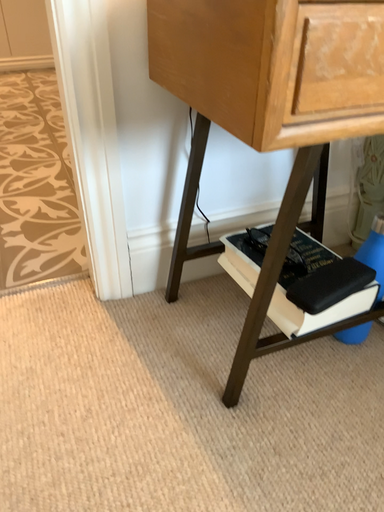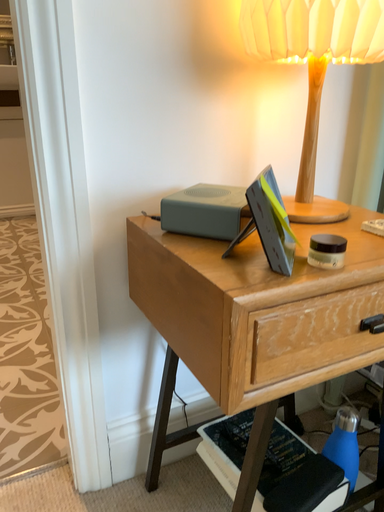
Question: How did the camera likely rotate when shooting the video?

Choices:
 (A) rotated upward
 (B) rotated downward

Answer: (A)